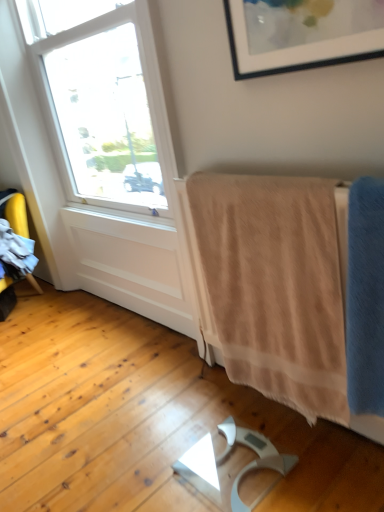
Question: From a real-world perspective, is blue soft towel at right, acting as the second bath towel starting from the back, above or below beige soft towel at lower right, which is the first bath towel from back to front?

Choices:
 (A) below
 (B) above

Answer: (B)

Question: Is blue soft towel at right, acting as the second bath towel starting from the back, wider or thinner than beige soft towel at lower right, the second bath towel when ordered from front to back?

Choices:
 (A) thin
 (B) wide

Answer: (B)

Question: Considering the positions of blue soft towel at right, arranged as the 1th bath towel when viewed from the front, and beige soft towel at lower right, which is the first bath towel from back to front, in the image, is blue soft towel at right, arranged as the 1th bath towel when viewed from the front, bigger or smaller than beige soft towel at lower right, which is the first bath towel from back to front,?

Choices:
 (A) big
 (B) small

Answer: (B)

Question: Is beige soft towel at lower right, the second bath towel when ordered from front to back, taller or shorter than blue soft towel at right, arranged as the 1th bath towel when viewed from the front?

Choices:
 (A) short
 (B) tall

Answer: (B)

Question: Is point (258, 238) closer or farther from the camera than point (357, 350)?

Choices:
 (A) farther
 (B) closer

Answer: (A)

Question: From the image's perspective, is beige soft towel at lower right, the second bath towel when ordered from front to back, located above or below blue soft towel at right, arranged as the 1th bath towel when viewed from the front?

Choices:
 (A) below
 (B) above

Answer: (B)

Question: In terms of size, does beige soft towel at lower right, which is the first bath towel from back to front, appear bigger or smaller than blue soft towel at right, arranged as the 1th bath towel when viewed from the front?

Choices:
 (A) big
 (B) small

Answer: (A)